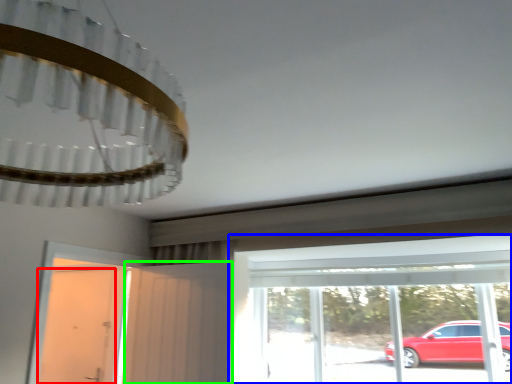
Question: Which object is the farthest from door (highlighted by a red box)? Choose among these: window (highlighted by a blue box) or screen door (highlighted by a green box).

Choices:
 (A) window
 (B) screen door

Answer: (A)